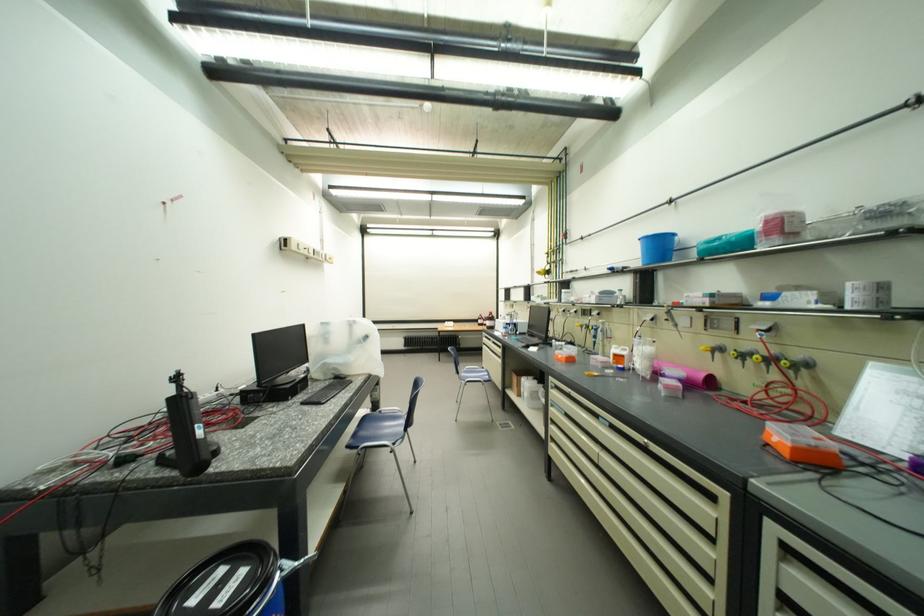
You are a GUI agent. You are given a task and a screenshot of the screen. Output one action in this format:
    pyautogui.click(x=<x>, y=<y>)
    Task: Click on the black bucket lid
    The image size is (924, 616).
    Given the screenshot: What is the action you would take?
    pyautogui.click(x=224, y=582)